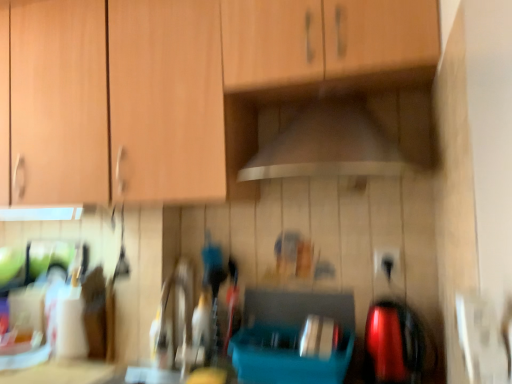
Question: From a real-world perspective, is white glossy countertop at lower left over wooden cabinet at upper center?

Choices:
 (A) yes
 (B) no

Answer: (B)

Question: Is white glossy countertop at lower left not close to wooden cabinet at upper center?

Choices:
 (A) no
 (B) yes

Answer: (A)

Question: Is white glossy countertop at lower left not inside wooden cabinet at upper center?

Choices:
 (A) no
 (B) yes

Answer: (B)

Question: Considering the relative positions of white glossy countertop at lower left and wooden cabinet at upper center in the image provided, is white glossy countertop at lower left to the left of wooden cabinet at upper center from the viewer's perspective?

Choices:
 (A) no
 (B) yes

Answer: (B)

Question: Does white glossy countertop at lower left have a lesser width compared to wooden cabinet at upper center?

Choices:
 (A) yes
 (B) no

Answer: (A)

Question: From the image's perspective, relative to white glossy countertop at lower left, is wooden cabinet at upper center above or below?

Choices:
 (A) below
 (B) above

Answer: (B)

Question: Considering the positions of wooden cabinet at upper center and white glossy countertop at lower left in the image, is wooden cabinet at upper center taller or shorter than white glossy countertop at lower left?

Choices:
 (A) tall
 (B) short

Answer: (A)

Question: Considering the positions of point (24, 135) and point (38, 365), is point (24, 135) closer or farther from the camera than point (38, 365)?

Choices:
 (A) farther
 (B) closer

Answer: (B)

Question: From a real-world perspective, is wooden cabinet at upper center positioned above or below white glossy countertop at lower left?

Choices:
 (A) above
 (B) below

Answer: (A)

Question: Would you say wooden cabinet at upper center is to the left or to the right of black plastic electric outlet at lower right in the picture?

Choices:
 (A) left
 (B) right

Answer: (A)

Question: Is point (367, 82) closer or farther from the camera than point (375, 258)?

Choices:
 (A) closer
 (B) farther

Answer: (A)

Question: Looking at their shapes, would you say wooden cabinet at upper center is wider or thinner than black plastic electric outlet at lower right?

Choices:
 (A) thin
 (B) wide

Answer: (B)

Question: Is wooden cabinet at upper center spatially inside black plastic electric outlet at lower right, or outside of it?

Choices:
 (A) inside
 (B) outside

Answer: (B)

Question: Considering the positions of black plastic electric outlet at lower right and wooden cabinet at upper center in the image, is black plastic electric outlet at lower right wider or thinner than wooden cabinet at upper center?

Choices:
 (A) wide
 (B) thin

Answer: (B)

Question: Choose the correct answer: Is black plastic electric outlet at lower right inside wooden cabinet at upper center or outside it?

Choices:
 (A) inside
 (B) outside

Answer: (B)